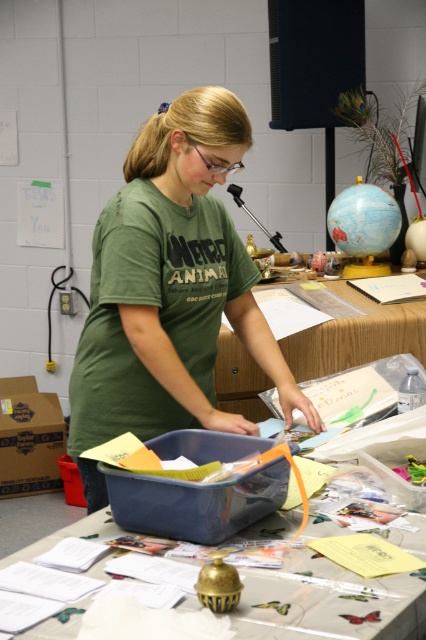
Does green matte shirt at center appear on the right side of wooden table at center?

Incorrect, green matte shirt at center is not on the right side of wooden table at center.

Is green matte shirt at center shorter than wooden table at center?

No.

What do you see at coordinates (169, 289) in the screenshot? The image size is (426, 640). I see `green matte shirt at center` at bounding box center [169, 289].

This screenshot has width=426, height=640. In order to click on green matte shirt at center in this screenshot , I will do `click(169, 289)`.

Who is more forward, (94, 300) or (388, 612)?

Positioned in front is point (388, 612).

Is green matte shirt at center taller than translucent plastic table at center?

Correct, green matte shirt at center is much taller as translucent plastic table at center.

Does point (189, 115) lie behind point (293, 621)?

That is True.

Identify the location of green matte shirt at center. This screenshot has width=426, height=640. (169, 289).

Between point (267, 600) and point (293, 344), which one is positioned behind?

Positioned behind is point (293, 344).

Measure the distance between translucent plastic table at center and wooden table at center.

translucent plastic table at center is 1.11 meters from wooden table at center.

At what (x,y) coordinates should I click in order to perform the action: click on translucent plastic table at center. Please return your answer as a coordinate pair (x, y). The width and height of the screenshot is (426, 640). Looking at the image, I should click on (327, 602).

Locate an element on the screen. translucent plastic table at center is located at coordinates (327, 602).